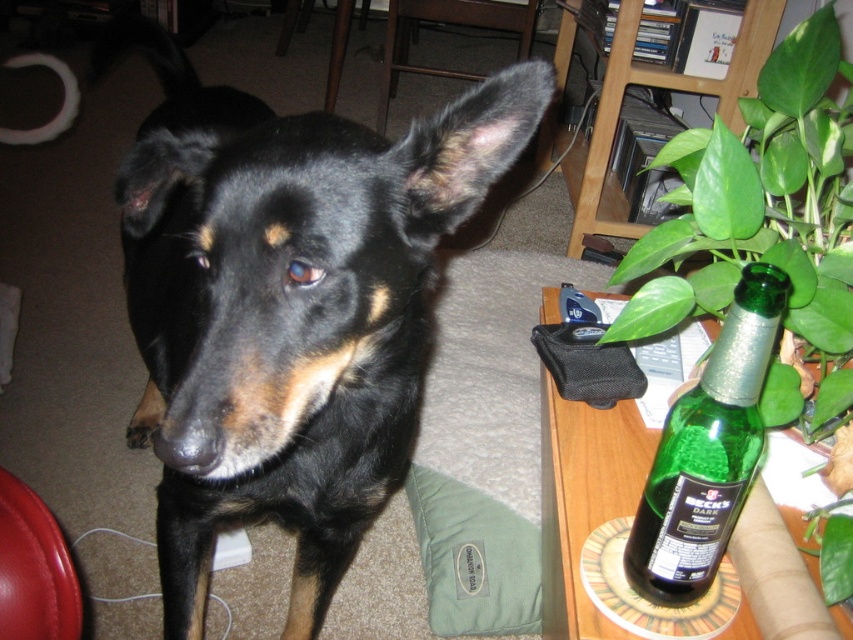
Between black shiny fur dog at center and green glass bottle at lower right, which one appears on the right side from the viewer's perspective?

green glass bottle at lower right

Who is shorter, black shiny fur dog at center or green glass bottle at lower right?

Standing shorter between the two is green glass bottle at lower right.

What do you see at coordinates (288, 307) in the screenshot? I see `black shiny fur dog at center` at bounding box center [288, 307].

The height and width of the screenshot is (640, 853). I want to click on black shiny fur dog at center, so click(x=288, y=307).

Find the location of a particular element. black shiny fur dog at center is located at coordinates (288, 307).

Who is shorter, black shiny fur dog at center or green leafy plant at right?

With less height is green leafy plant at right.

The height and width of the screenshot is (640, 853). What do you see at coordinates (288, 307) in the screenshot? I see `black shiny fur dog at center` at bounding box center [288, 307].

Where is `black shiny fur dog at center`? black shiny fur dog at center is located at coordinates (288, 307).

Can you confirm if green leafy plant at right is taller than green glass bottle at lower right?

Yes.

At what (x,y) coordinates should I click in order to perform the action: click on green leafy plant at right. Please return your answer as a coordinate pair (x, y). Looking at the image, I should click on [767, 224].